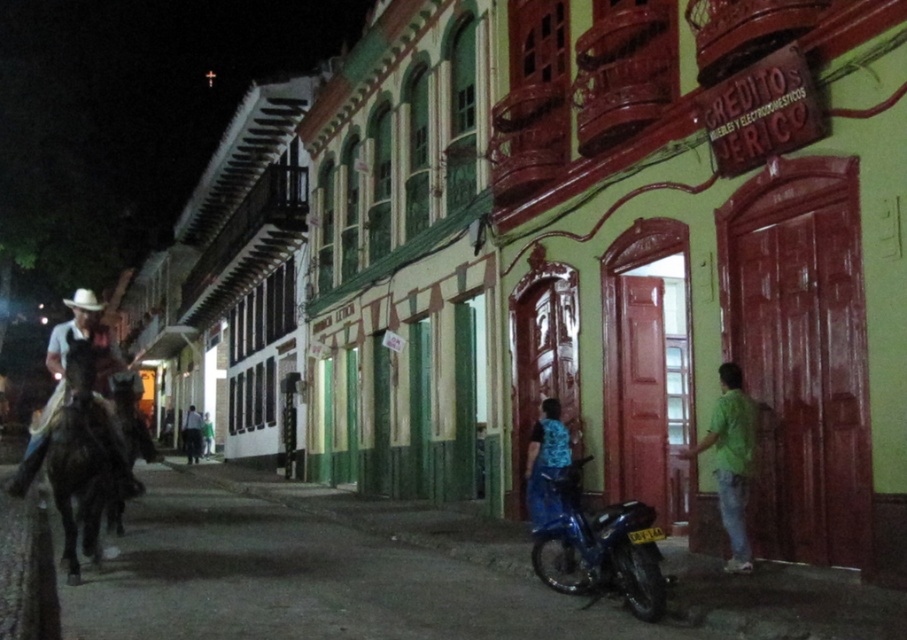
You are a delivery person who needs to park your shiny blue motorbike at lower center near the blue denim jeans at lower center. Since both are at the same location, will the motorbike block the jeans from being seen?

The shiny blue motorbike at lower center is larger than the blue denim jeans at lower center, so yes, the motorbike will block the jeans from being seen if parked nearby.

You are standing on a historic street at night, surrounded by colorful buildings with ornate details. You notice a lime green building with red accents on the right side of the street. There is a point marked at coordinates (655, 589). Considering the distance between you and this point, would you be able to reach it by taking three steps forward without moving sideways?

The distance between you and the point at (655, 589) is 6.65 meters. Since three steps typically cover about 2 to 3 meters, you would not be able to reach it with just three steps forward without moving sideways.